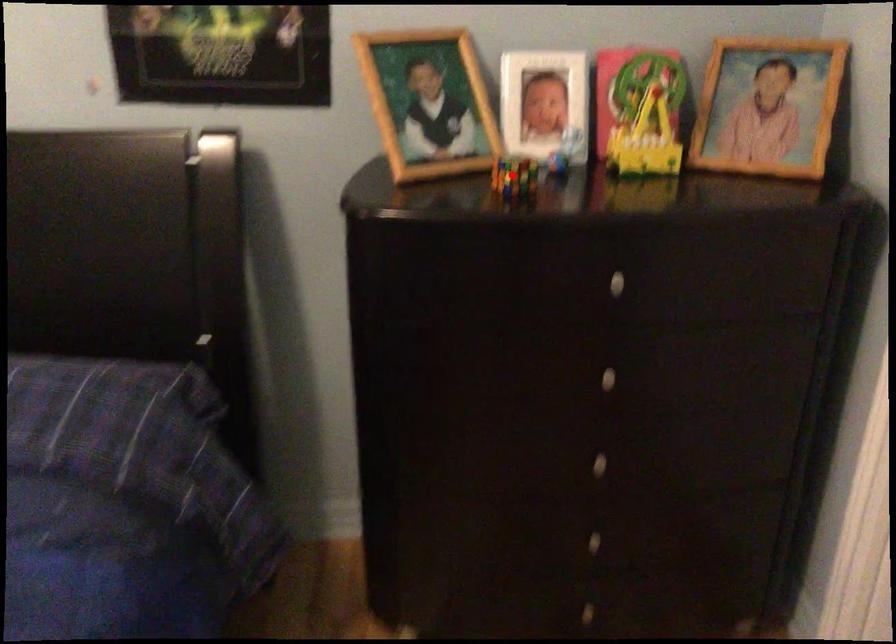
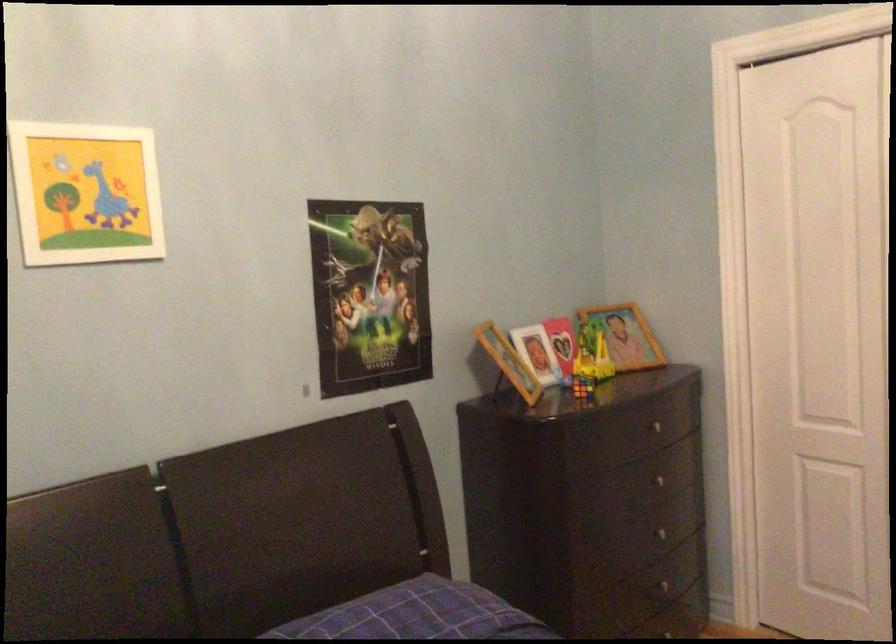
Question: I am providing you with two images of the same scene from different viewpoints. In image1, a red point is highlighted. Considering the same 3D point in image2, which of the following is correct?

Choices:
 (A) It is closer
 (B) It is farther

Answer: (B)